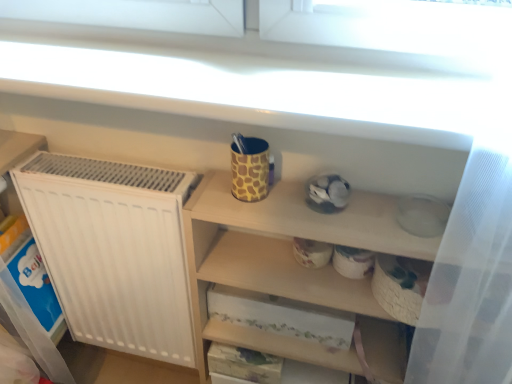
Question: Considering the relative sizes of giraffe-patterned ceramic mug at upper center and wooden shelf at upper center in the image provided, is giraffe-patterned ceramic mug at upper center taller than wooden shelf at upper center?

Choices:
 (A) yes
 (B) no

Answer: (B)

Question: Is giraffe-patterned ceramic mug at upper center positioned in front of wooden shelf at upper center?

Choices:
 (A) no
 (B) yes

Answer: (A)

Question: From the image's perspective, would you say giraffe-patterned ceramic mug at upper center is positioned over wooden shelf at upper center?

Choices:
 (A) yes
 (B) no

Answer: (A)

Question: Is giraffe-patterned ceramic mug at upper center at the left side of wooden shelf at upper center?

Choices:
 (A) yes
 (B) no

Answer: (A)

Question: Does giraffe-patterned ceramic mug at upper center turn towards wooden shelf at upper center?

Choices:
 (A) yes
 (B) no

Answer: (B)

Question: From a real-world perspective, is giraffe-patterned ceramic mug at upper center physically below wooden shelf at upper center?

Choices:
 (A) no
 (B) yes

Answer: (A)

Question: From the image's perspective, would you say wooden shelf at upper center is shown under giraffe-patterned ceramic mug at upper center?

Choices:
 (A) yes
 (B) no

Answer: (A)

Question: From the image's perspective, does wooden shelf at upper center appear higher than giraffe-patterned ceramic mug at upper center?

Choices:
 (A) yes
 (B) no

Answer: (B)

Question: Can you confirm if wooden shelf at upper center is positioned to the left of giraffe-patterned ceramic mug at upper center?

Choices:
 (A) no
 (B) yes

Answer: (A)

Question: From a real-world perspective, is wooden shelf at upper center over giraffe-patterned ceramic mug at upper center?

Choices:
 (A) no
 (B) yes

Answer: (A)

Question: Is wooden shelf at upper center not close to giraffe-patterned ceramic mug at upper center?

Choices:
 (A) yes
 (B) no

Answer: (B)

Question: Does wooden shelf at upper center have a larger size compared to giraffe-patterned ceramic mug at upper center?

Choices:
 (A) yes
 (B) no

Answer: (A)

Question: Considering the positions of giraffe-patterned ceramic mug at upper center and wooden shelf at upper center in the image, is giraffe-patterned ceramic mug at upper center taller or shorter than wooden shelf at upper center?

Choices:
 (A) tall
 (B) short

Answer: (B)